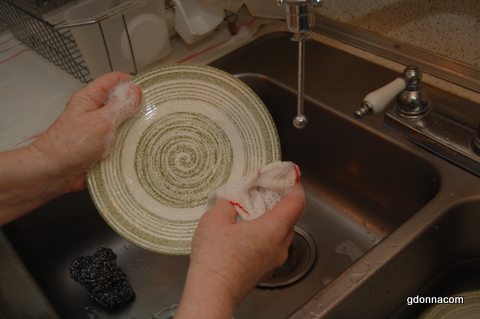
I want to click on towel, so click(x=217, y=46).